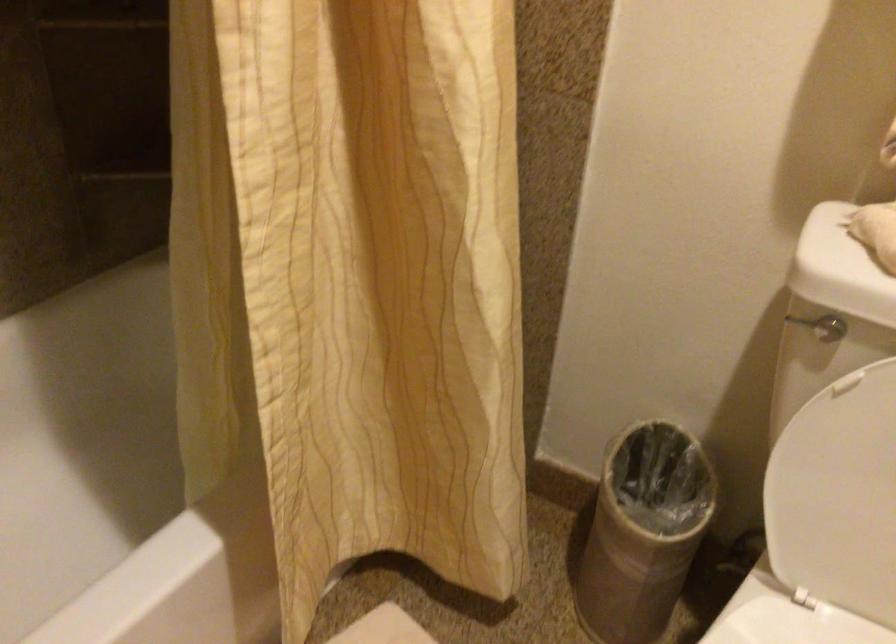
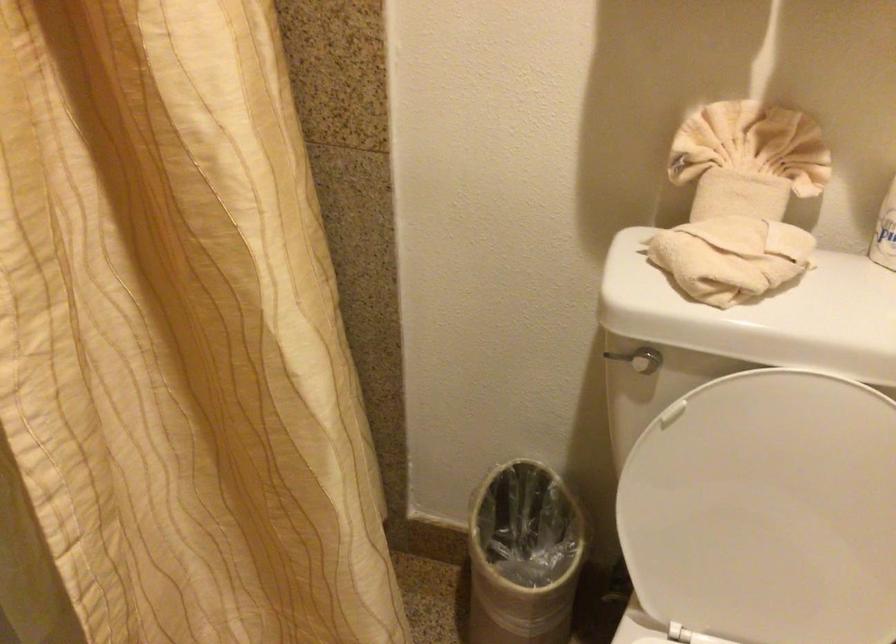
Locate, in the second image, the point that corresponds to [797,319] in the first image.

(616, 357)